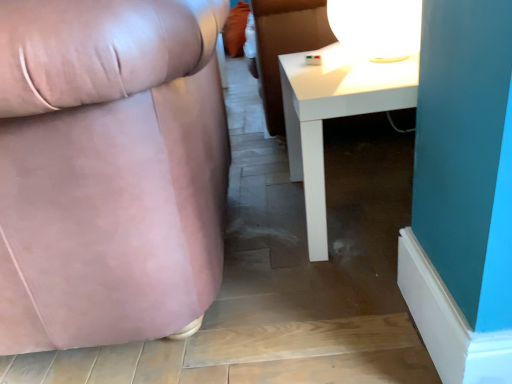
The image size is (512, 384). What are the coordinates of `vacant area on the back side of white glossy table at lower right` in the screenshot? It's located at (323, 153).